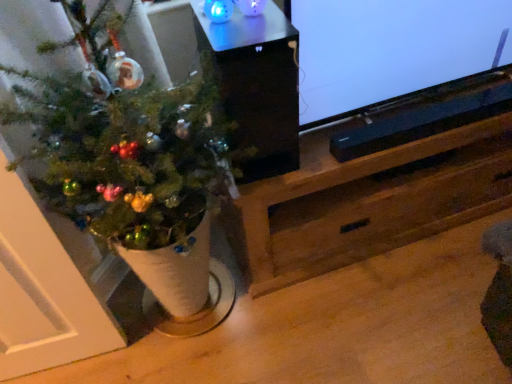
Question: Does black glossy speaker at upper center come in front of matte black speaker at upper right?

Choices:
 (A) yes
 (B) no

Answer: (A)

Question: From the image's perspective, is black glossy speaker at upper center below matte black speaker at upper right?

Choices:
 (A) yes
 (B) no

Answer: (A)

Question: Can you confirm if black glossy speaker at upper center is positioned to the right of matte black speaker at upper right?

Choices:
 (A) no
 (B) yes

Answer: (A)

Question: Is black glossy speaker at upper center aimed at matte black speaker at upper right?

Choices:
 (A) yes
 (B) no

Answer: (B)

Question: Can you confirm if black glossy speaker at upper center is smaller than matte black speaker at upper right?

Choices:
 (A) yes
 (B) no

Answer: (A)

Question: Considering the positions of point (225, 87) and point (202, 183), is point (225, 87) closer or farther from the camera than point (202, 183)?

Choices:
 (A) closer
 (B) farther

Answer: (A)

Question: Considering their positions, is black glossy speaker at upper center located in front of or behind green matte christmas tree at left?

Choices:
 (A) behind
 (B) front

Answer: (A)

Question: In terms of height, does black glossy speaker at upper center look taller or shorter compared to green matte christmas tree at left?

Choices:
 (A) tall
 (B) short

Answer: (B)

Question: From a real-world perspective, relative to green matte christmas tree at left, is black glossy speaker at upper center vertically above or below?

Choices:
 (A) above
 (B) below

Answer: (A)

Question: Considering the positions of matte black speaker at upper right and black glossy speaker at upper center in the image, is matte black speaker at upper right taller or shorter than black glossy speaker at upper center?

Choices:
 (A) tall
 (B) short

Answer: (A)

Question: Choose the correct answer: Is matte black speaker at upper right inside black glossy speaker at upper center or outside it?

Choices:
 (A) outside
 (B) inside

Answer: (A)

Question: Is matte black speaker at upper right bigger or smaller than black glossy speaker at upper center?

Choices:
 (A) big
 (B) small

Answer: (A)

Question: Considering the positions of point (379, 97) and point (278, 137), is point (379, 97) closer or farther from the camera than point (278, 137)?

Choices:
 (A) closer
 (B) farther

Answer: (B)

Question: Looking at their shapes, would you say black plastic soundbar at lower center is wider or thinner than black glossy speaker at upper center?

Choices:
 (A) wide
 (B) thin

Answer: (B)

Question: Is black plastic soundbar at lower center to the left or to the right of black glossy speaker at upper center in the image?

Choices:
 (A) left
 (B) right

Answer: (B)